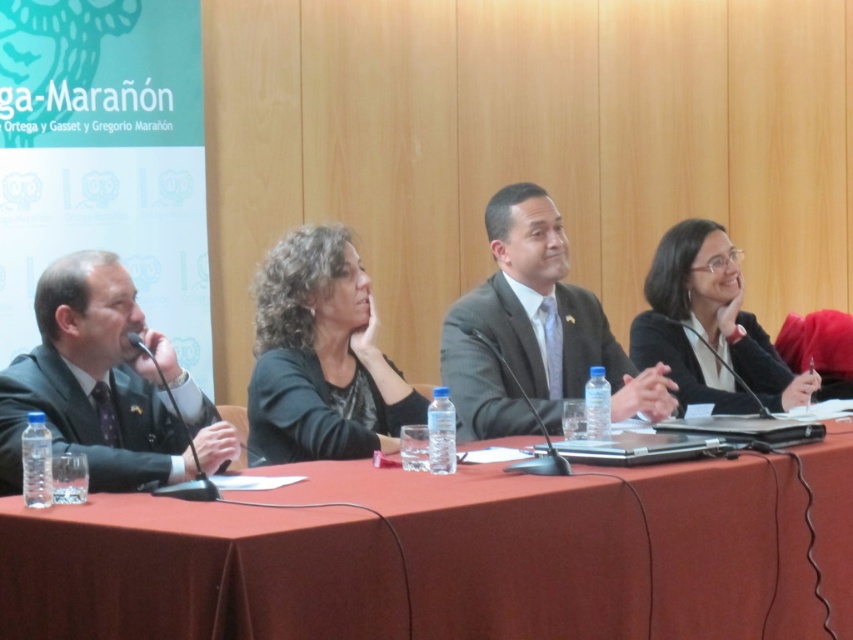
Question: Among these objects, which one is farthest from the camera?

Choices:
 (A) black glossy blazer at right
 (B) matte black suit at left
 (C) black matte business suit at center

Answer: (A)

Question: Which object is the farthest from the black matte business suit at center?

Choices:
 (A) smooth red tablecloth at center
 (B) black matte jacket at center
 (C) black matte blazer at center
 (D) matte black suit at left

Answer: (D)

Question: Is black matte jacket at center to the right of black glossy blazer at right from the viewer's perspective?

Choices:
 (A) yes
 (B) no

Answer: (B)

Question: Among these points, which one is nearest to the camera?

Choices:
 (A) (363, 394)
 (B) (517, 416)
 (C) (106, 454)
 (D) (225, 588)

Answer: (D)

Question: Is gray suit at center thinner than black glossy blazer at right?

Choices:
 (A) yes
 (B) no

Answer: (B)

Question: From the image, what is the correct spatial relationship of matte black suit at left in relation to black glossy blazer at right?

Choices:
 (A) left
 (B) right

Answer: (A)